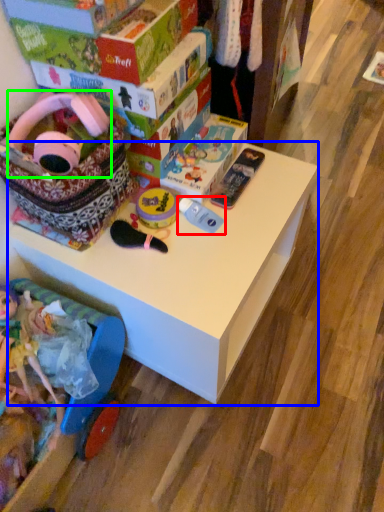
Question: Which is farther away from toy (highlighted by a red box)? table (highlighted by a blue box) or toy (highlighted by a green box)?

Choices:
 (A) table
 (B) toy

Answer: (B)